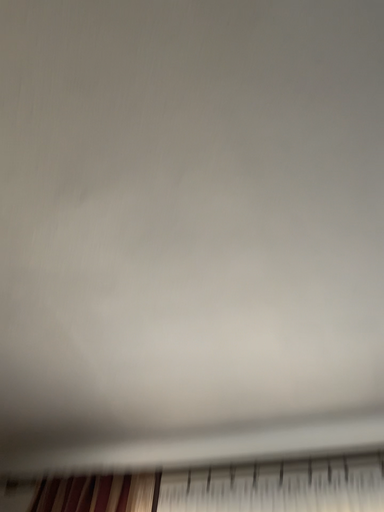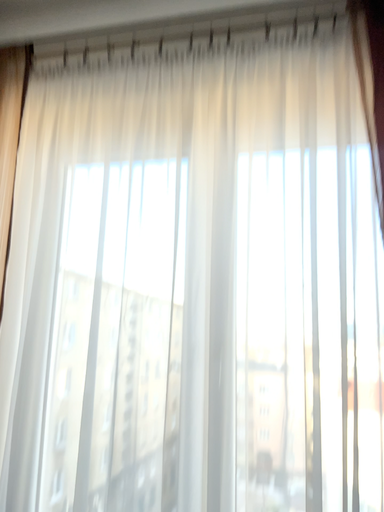
Question: Which way did the camera rotate in the video?

Choices:
 (A) rotated downward
 (B) rotated upward

Answer: (A)